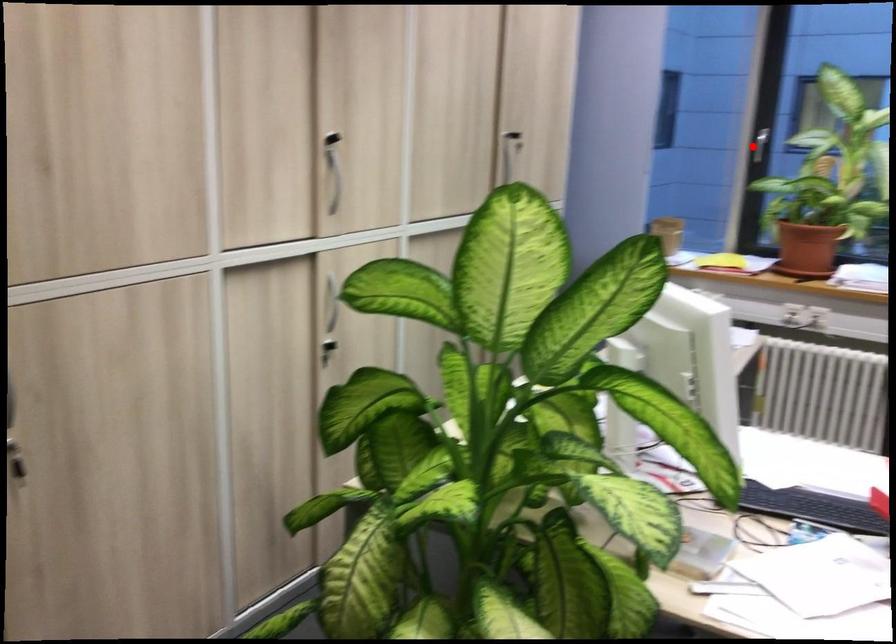
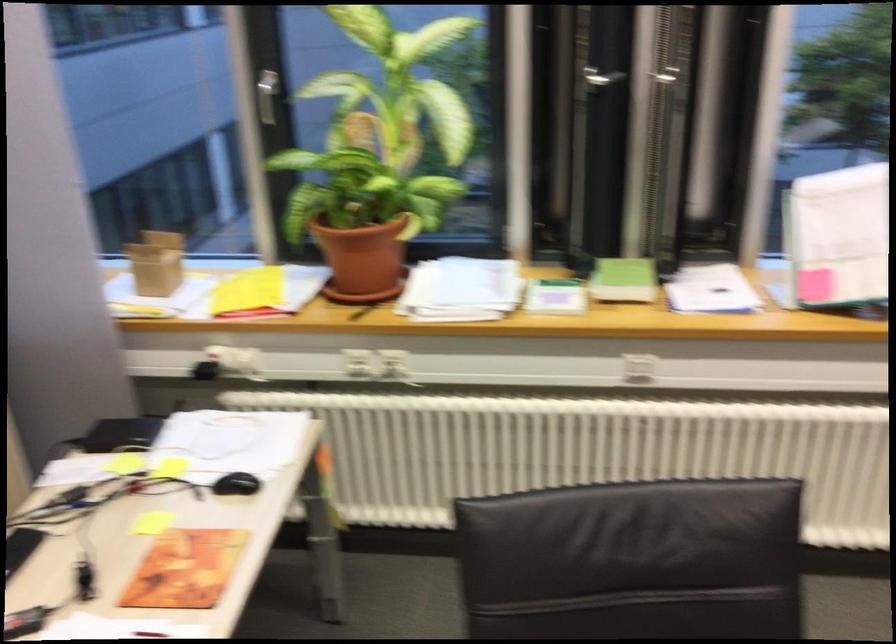
Question: I am providing you with two images of the same scene from different viewpoints. A red point is marked on the first image. Is the red point's position out of view in image 2?

Choices:
 (A) Yes
 (B) No

Answer: (B)